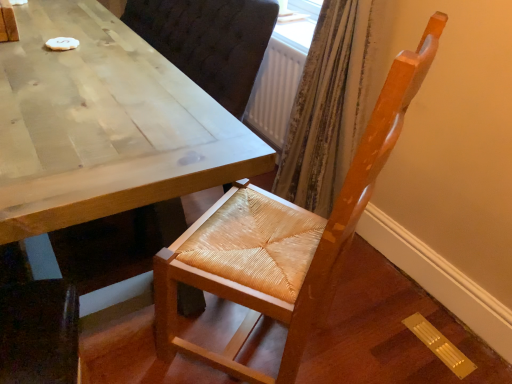
Where is `vacant area on top of light brown wooden table at center (from a real-world perspective)`? The height and width of the screenshot is (384, 512). vacant area on top of light brown wooden table at center (from a real-world perspective) is located at coordinates (71, 66).